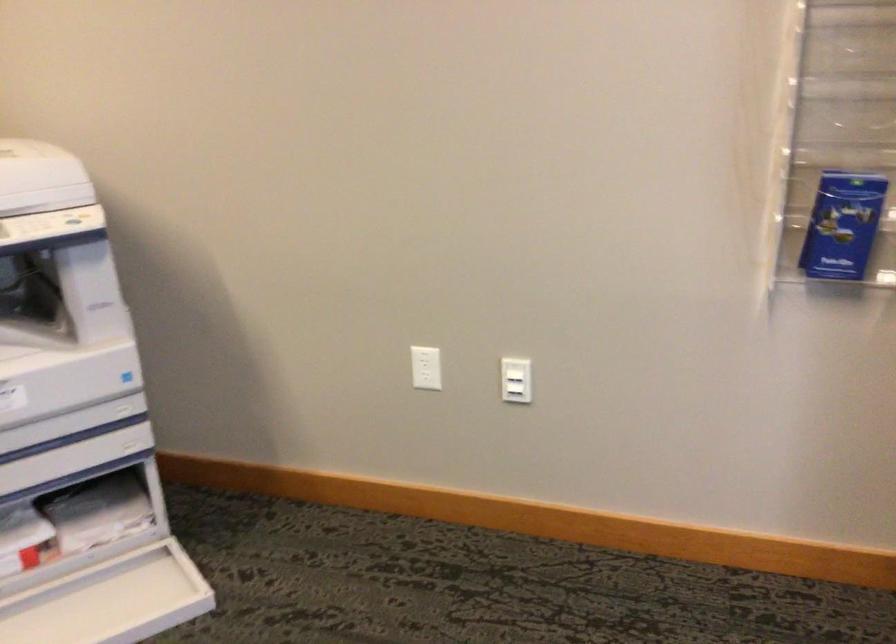
Where would you pull the copier tray? Please return your answer as a coordinate pair (x, y).

(91, 523)